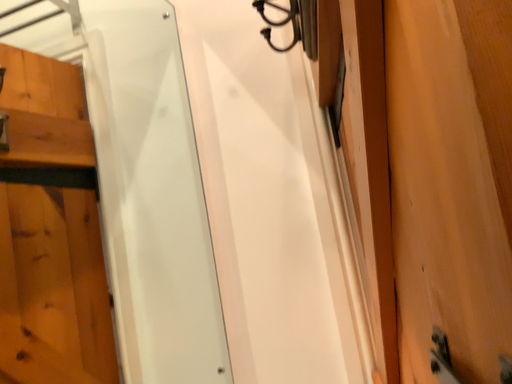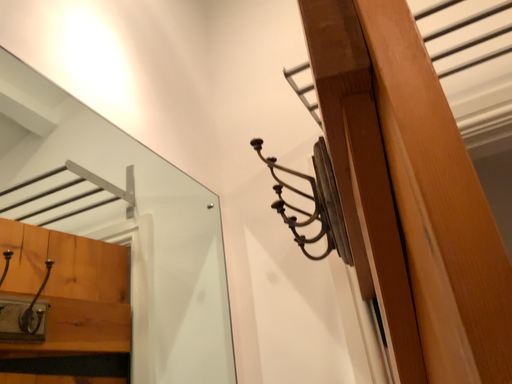
Question: How did the camera likely rotate when shooting the video?

Choices:
 (A) rotated downward
 (B) rotated upward

Answer: (B)